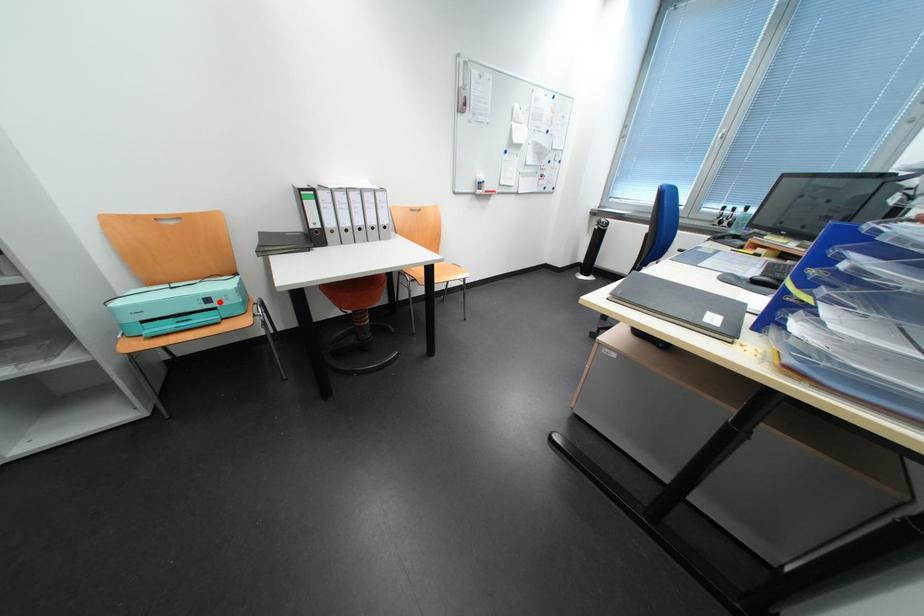
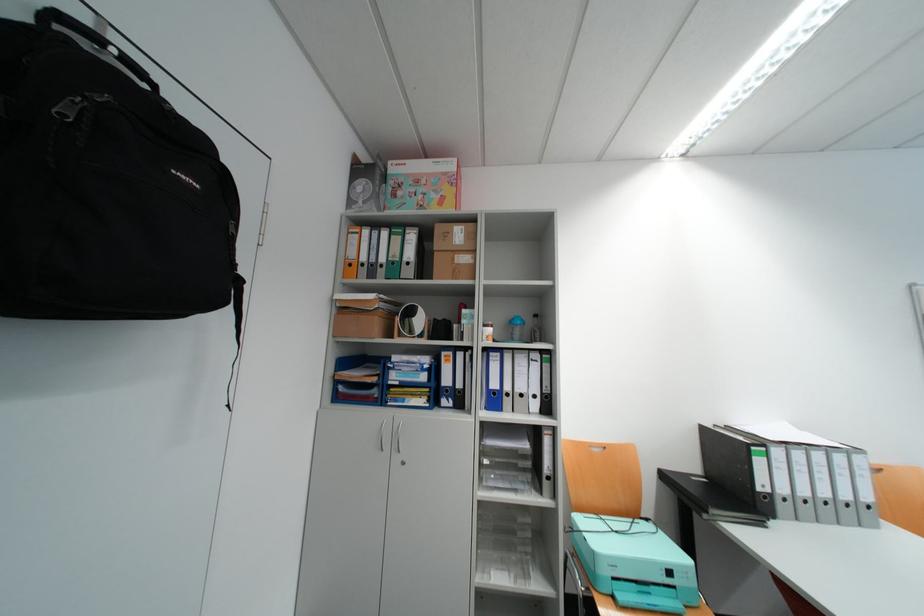
Find the pixel in the second image that matches the highlighted location in the first image.

(682, 573)